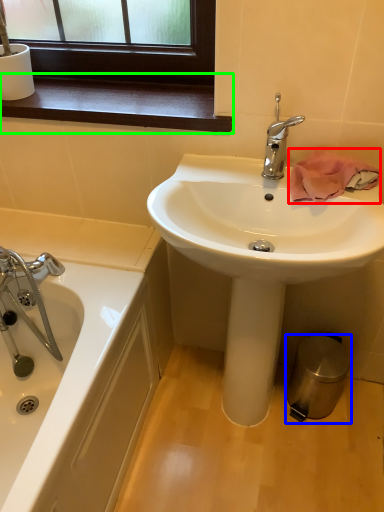
Question: Estimate the real-world distances between objects in this image. Which object is farther from bath towel (highlighted by a red box), trash bin/can (highlighted by a blue box) or window sill (highlighted by a green box)?

Choices:
 (A) trash bin/can
 (B) window sill

Answer: (A)